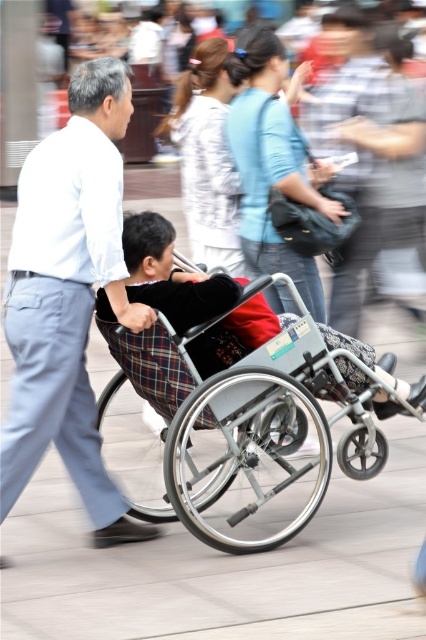
You are a delivery drone flying at an altitude of 10 meters above the ground. You need to land at the point marked as point (28, 369). Can you safely descend vertically to reach it without hitting any obstacles?

The point (28, 369) is 6.59 meters away from the camera, so the drone can safely descend vertically as there are no obstacles mentioned in the scene description that would interfere with its path.

You are a delivery person trying to navigate through the street scene shown. You need to deliver a package to the person in the wheelchair. However, there is a low hanging sign that might obstruct your path. Can you safely pass under the sign without hitting the metallic gray wheelchair at center, considering the position of the light blue cotton shirt at left?

The light blue cotton shirt at left is above the metallic gray wheelchair at center, meaning the sign is positioned higher than the wheelchair. Since the sign is low hanging but still above the wheelchair, you can safely pass under it without hitting the metallic gray wheelchair at center.

You are a delivery person trying to navigate through the street scene. You see the light blue cotton shirt at left and the metallic gray wheelchair at center. Which object takes up more space in the image?

The metallic gray wheelchair at center takes up more space in the image because the light blue cotton shirt at left is smaller than it.